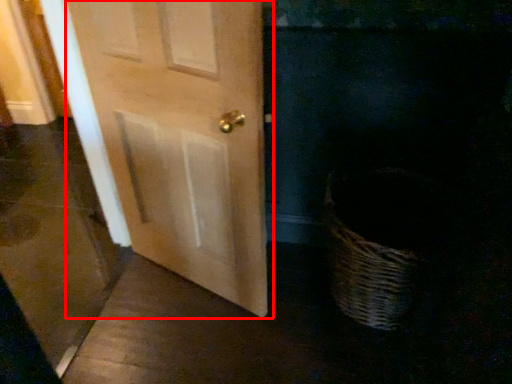
Question: From the image, what is the correct spatial relationship of door (annotated by the red box) in relation to screen door?

Choices:
 (A) left
 (B) right

Answer: (B)